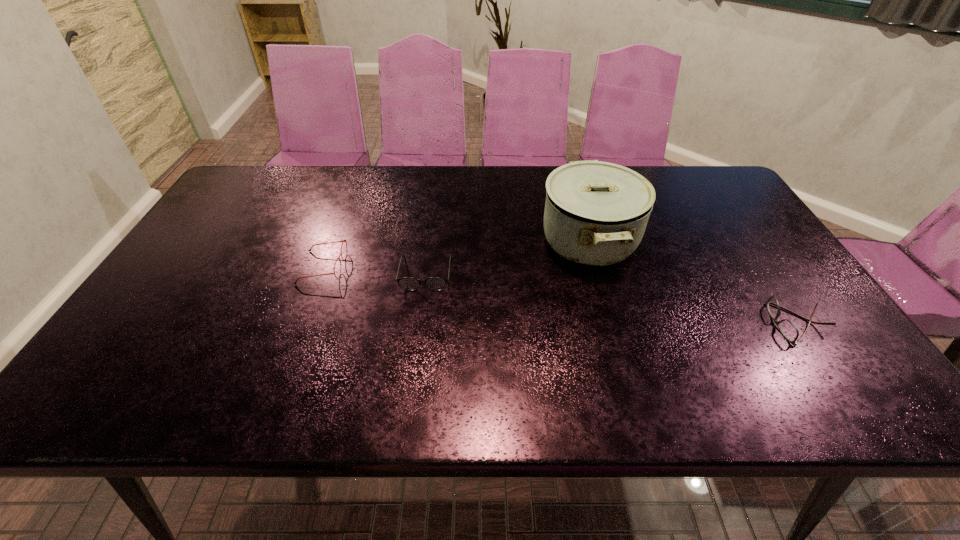
This screenshot has height=540, width=960. Find the location of `vacant space situated on the front-facing side of the nearest object`. vacant space situated on the front-facing side of the nearest object is located at coordinates (633, 323).

Where is `free region located 0.240m on the front-facing side of the nearest object`? The width and height of the screenshot is (960, 540). free region located 0.240m on the front-facing side of the nearest object is located at coordinates (671, 323).

Identify the location of object located in the far edge section of the desktop. The width and height of the screenshot is (960, 540). (596, 213).

Find the location of a particular element. object present at the right edge is located at coordinates (787, 328).

You are a GUI agent. You are given a task and a screenshot of the screen. Output one action in this format:
    pyautogui.click(x=<x>, y=<y>)
    Task: Click on the free space at the far edge
    This screenshot has width=960, height=540.
    Given the screenshot: What is the action you would take?
    pyautogui.click(x=539, y=168)

Find the location of a particular element. The height and width of the screenshot is (540, 960). vacant space at the near edge of the desktop is located at coordinates tap(714, 401).

Where is `free space at the left edge of the desktop`? This screenshot has height=540, width=960. free space at the left edge of the desktop is located at coordinates (113, 361).

Where is `vacant space at the right edge`? The image size is (960, 540). vacant space at the right edge is located at coordinates (780, 279).

In the image, there is a desktop. At what (x,y) coordinates should I click in order to perform the action: click on free space at the far left corner. Please return your answer as a coordinate pair (x, y). This screenshot has width=960, height=540. Looking at the image, I should click on (261, 177).

Locate an element on the screen. vacant space at the far right corner of the desktop is located at coordinates (706, 167).